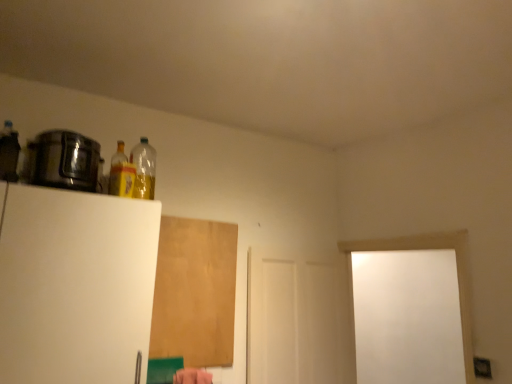
Question: Is point (135, 190) positioned closer to the camera than point (83, 144)?

Choices:
 (A) farther
 (B) closer

Answer: (A)

Question: In terms of size, does translucent plastic bottle at upper left, acting as the 3th bottle starting from the front, appear bigger or smaller than shiny metallic pot at left, arranged as the 1th appliance when viewed from the top?

Choices:
 (A) small
 (B) big

Answer: (A)

Question: Considering the real-world distances, which object is farthest from the white matte door at center?

Choices:
 (A) matte black bottle at upper left, which is counted as the 1th bottle, starting from the front
 (B) brown matte plywood at upper center
 (C) shiny metallic pot at left, the second appliance when ordered from bottom to top
 (D) translucent yellow bottle at upper left, the second bottle from the front
 (E) translucent plastic bottle at upper left, acting as the 3th bottle starting from the front

Answer: (A)

Question: Which object is the closest to the white matte door at center?

Choices:
 (A) translucent plastic bottle at upper left, acting as the 3th bottle starting from the front
 (B) translucent yellow bottle at upper left, arranged as the second bottle when viewed from the left
 (C) matte black bottle at upper left, the 3th bottle viewed from the back
 (D) shiny metallic pot at left, arranged as the 1th appliance when viewed from the top
 (E) brown matte plywood at upper center

Answer: (E)